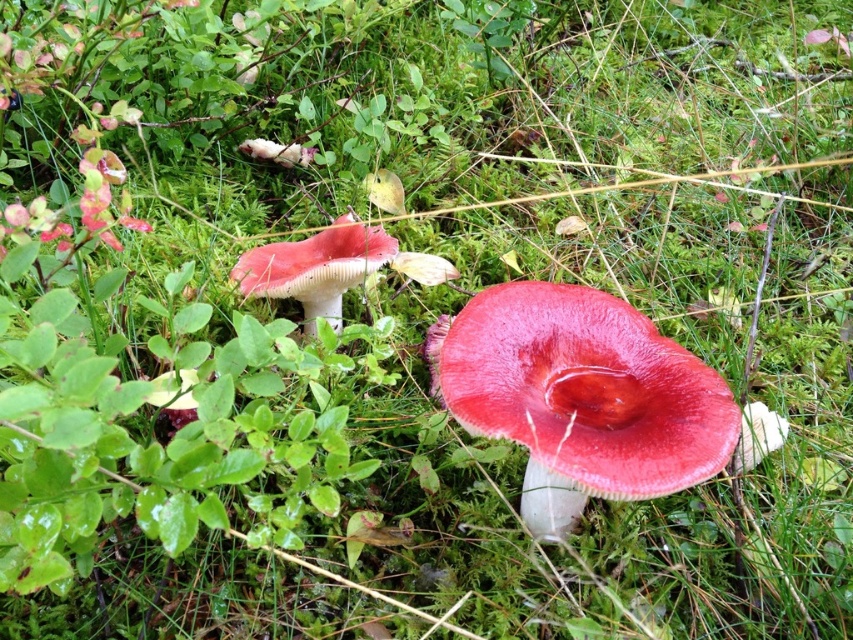
Who is more forward, [657,390] or [379,252]?

Point [657,390] is more forward.

Is point (712, 422) behind point (331, 243)?

No, it is in front of (331, 243).

Locate an element on the screen. This screenshot has height=640, width=853. shiny red mushroom at center is located at coordinates (579, 396).